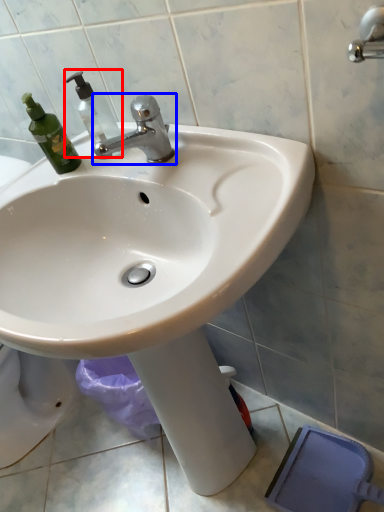
Question: Which point is further to the camera, soap dispenser (highlighted by a red box) or tap (highlighted by a blue box)?

Choices:
 (A) soap dispenser
 (B) tap

Answer: (A)